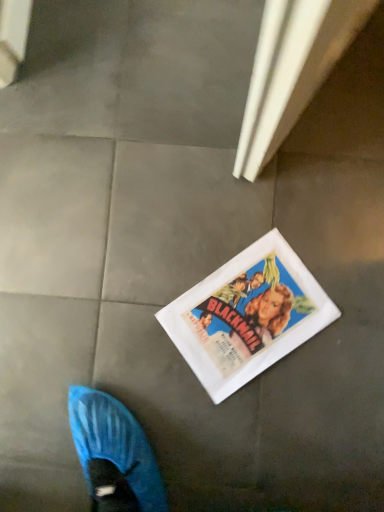
Where is `free point above white paper movie poster at center (from a real-world perspective)`? The height and width of the screenshot is (512, 384). free point above white paper movie poster at center (from a real-world perspective) is located at coordinates point(243,318).